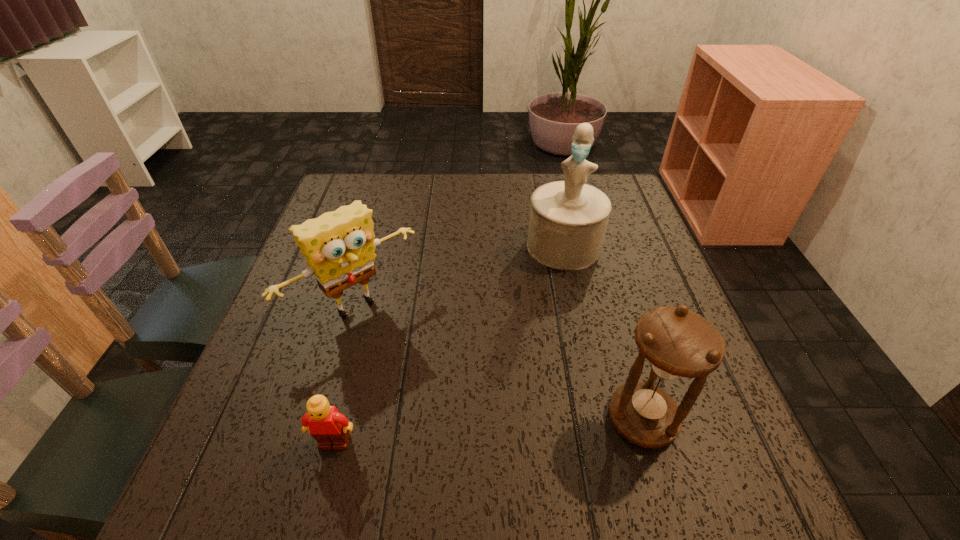
Image resolution: width=960 pixels, height=540 pixels. What are the coordinates of `Lego` in the screenshot? It's located at (326, 425).

Identify the location of hourglass. This screenshot has height=540, width=960. (677, 343).

Where is `the tallest object`? The height and width of the screenshot is (540, 960). the tallest object is located at coordinates (568, 219).

You are a GUI agent. You are given a task and a screenshot of the screen. Output one action in this format:
    pyautogui.click(x=<x>, y=<y>)
    Task: Click on the figurine
    
    Given the screenshot: What is the action you would take?
    pyautogui.click(x=568, y=219)

At what (x,y) coordinates should I click in order to perform the action: click on sponge. Please return your answer as a coordinate pair (x, y). The height and width of the screenshot is (540, 960). Looking at the image, I should click on (339, 246).

Identify the location of vacant region located 0.060m on the left of the hourglass. (574, 418).

Find the location of a particular element. The width and height of the screenshot is (960, 540). free space located 0.080m at the beak of the tallest object is located at coordinates (553, 292).

The image size is (960, 540). Identify the location of vacant space located 0.290m at the beak of the tallest object. point(535,364).

Find the location of `vacant region located at the beak of the tallest object`. vacant region located at the beak of the tallest object is located at coordinates (546, 317).

Where is `vacant space positioned on the face of the sponge`? The height and width of the screenshot is (540, 960). vacant space positioned on the face of the sponge is located at coordinates (402, 352).